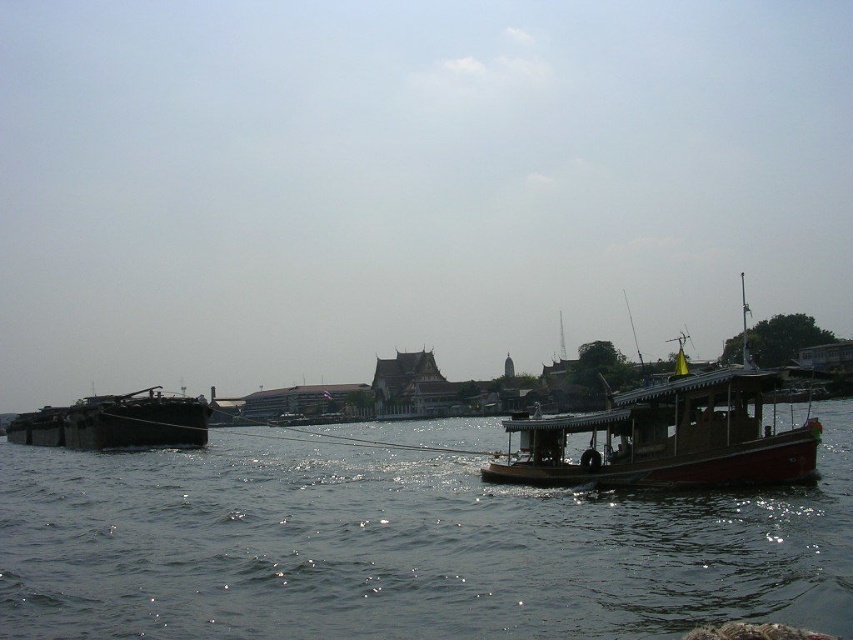
Question: Does smooth water at center come behind dark brown wooden barge at left?

Choices:
 (A) no
 (B) yes

Answer: (A)

Question: Can you confirm if wooden boat at center is bigger than dark brown wooden barge at left?

Choices:
 (A) yes
 (B) no

Answer: (B)

Question: Which point is closer to the camera taking this photo?

Choices:
 (A) (761, 480)
 (B) (413, 525)

Answer: (A)

Question: Among these points, which one is farthest from the camera?

Choices:
 (A) (296, 595)
 (B) (805, 419)

Answer: (B)

Question: Estimate the real-world distances between objects in this image. Which object is farther from the smooth water at center?

Choices:
 (A) dark brown wooden barge at left
 (B) wooden boat at center

Answer: (A)

Question: Does wooden boat at center have a greater width compared to dark brown wooden barge at left?

Choices:
 (A) yes
 (B) no

Answer: (B)